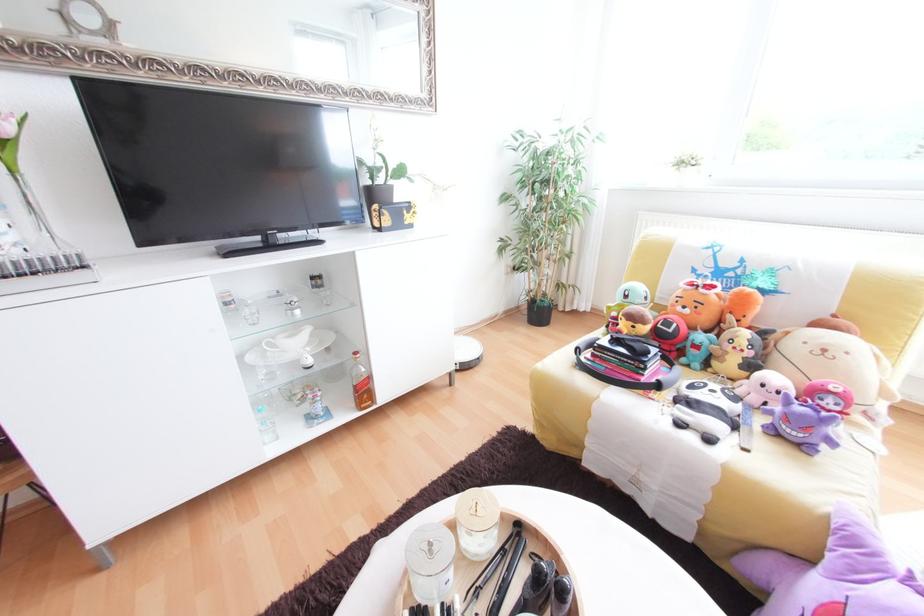
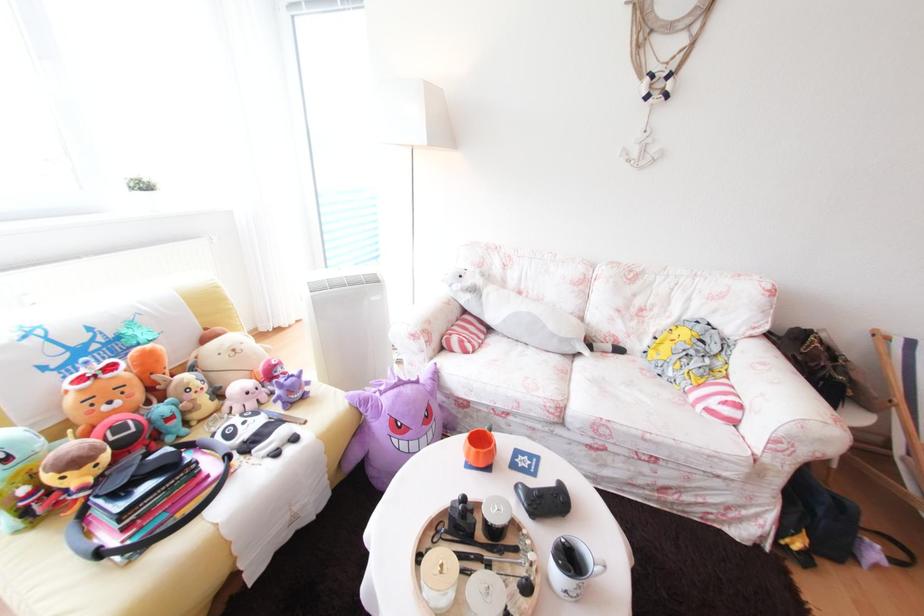
How did the camera likely rotate?

The rotation direction of the camera is right-down.